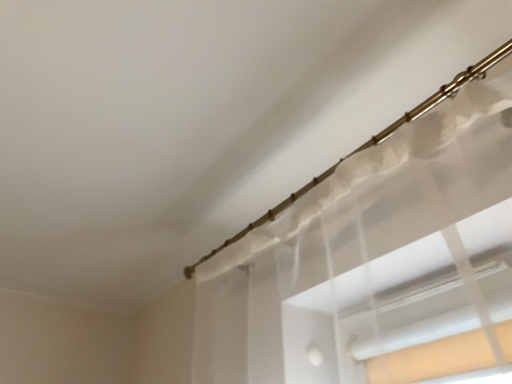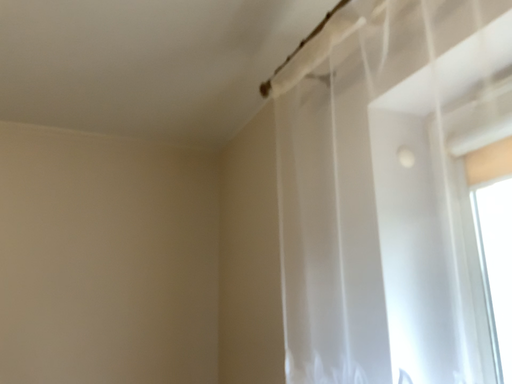
Question: Which way did the camera rotate in the video?

Choices:
 (A) rotated right
 (B) rotated left

Answer: (B)